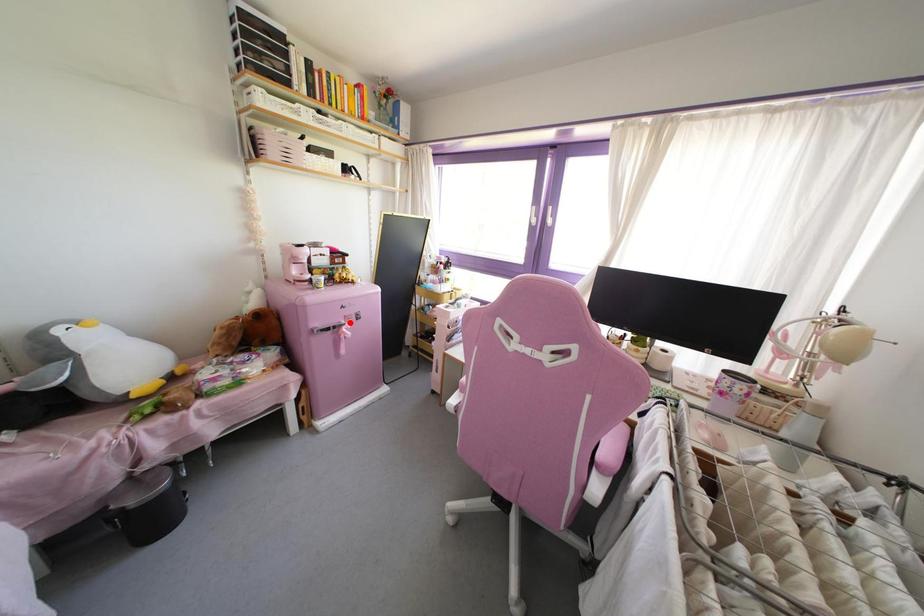
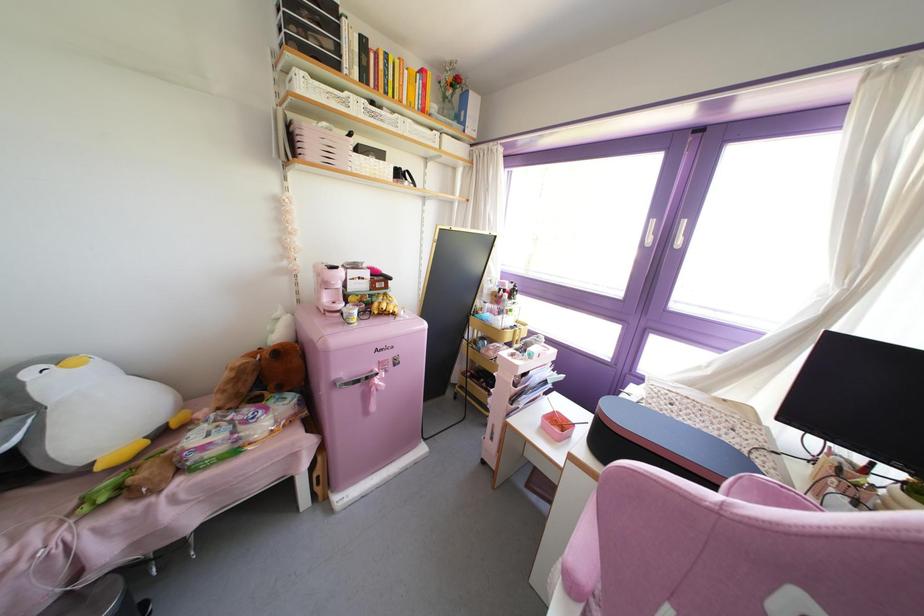
Find the pixel in the second image that matches the highlighted location in the first image.

(385, 371)